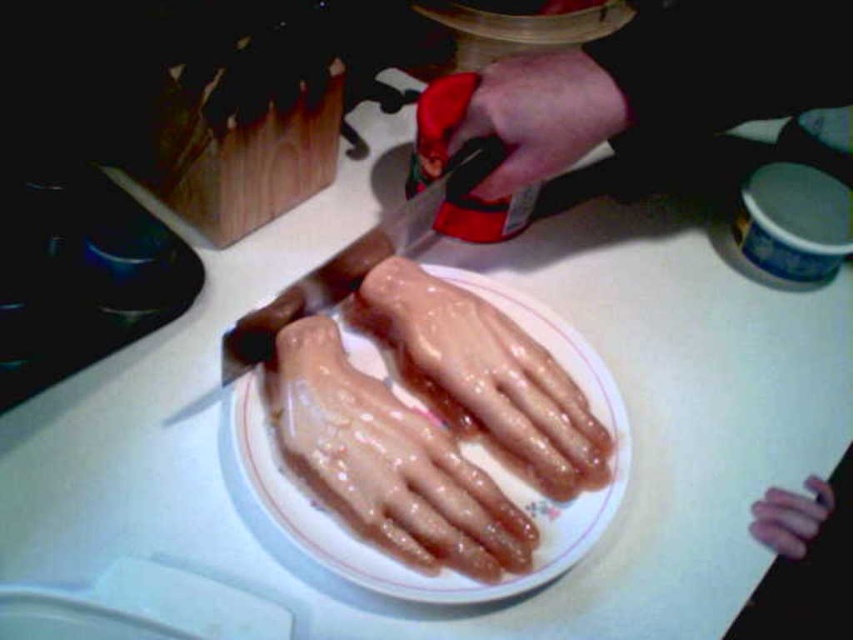
In the scene shown: You are a chef preparing a dish and need to choose between the smooth skin hand at upper center and the black plastic knife at center. Which tool is more suitable for cutting vegetables?

The black plastic knife at center is more suitable for cutting vegetables since it is larger in size compared to the smooth skin hand at upper center, which is smaller and likely not designed for cutting tasks.

You are organizing the kitchen tools on the countertop. The black plastic knife at center needs to be moved to the knife block. Can you determine the direction you should move it from its current position?

The black plastic knife at center is located at point (x=361, y=257). Since the knife block is to the left of the knife, you should move it to the left to place it into the knife block.

You are a chef preparing a dish and need to place a garnish on the white glossy plate at center. Since the pink rubber hand at center is in the way, can you lift the plate without moving the hand?

The white glossy plate at center has a greater height compared to the pink rubber hand at center, so you can lift the plate without moving the hand because it is taller.